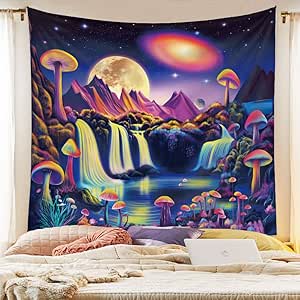
This screenshot has width=300, height=300. I want to click on bed, so click(x=181, y=275).